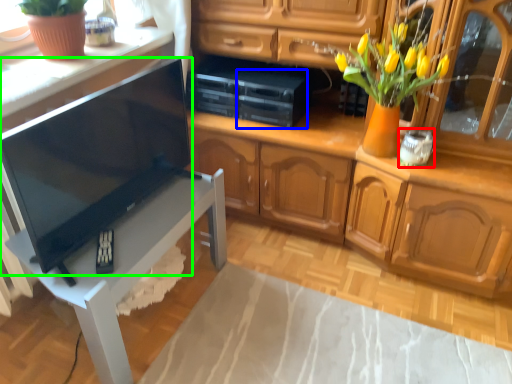
Question: Considering the real-world distances, which object is farthest from appliance (highlighted by a red box)? appliance (highlighted by a blue box) or television (highlighted by a green box)?

Choices:
 (A) appliance
 (B) television

Answer: (B)